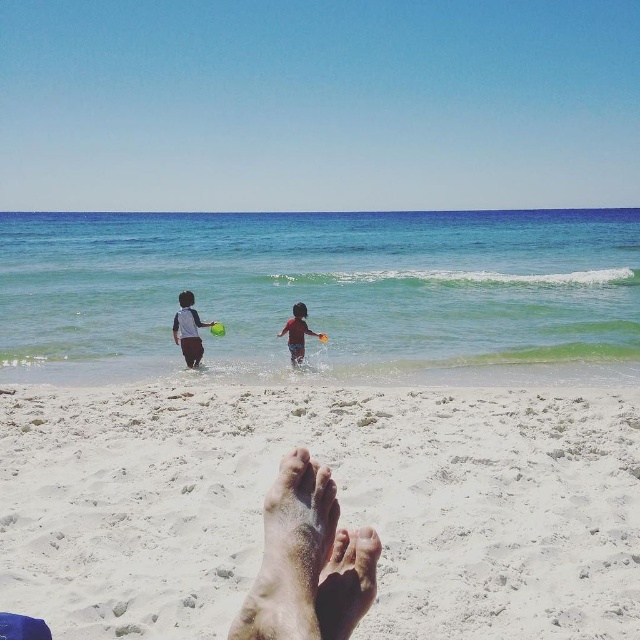
You are a lifeguard on duty and need to reach the red matte swimsuit at center to assist a swimmer. Considering your current position near the dry skin foot at lower center, can you estimate how far you need to move to reach the swimmer?

The dry skin foot at lower center and red matte swimsuit at center are 39.87 feet apart, so you need to move approximately 39.87 feet to reach the swimmer.